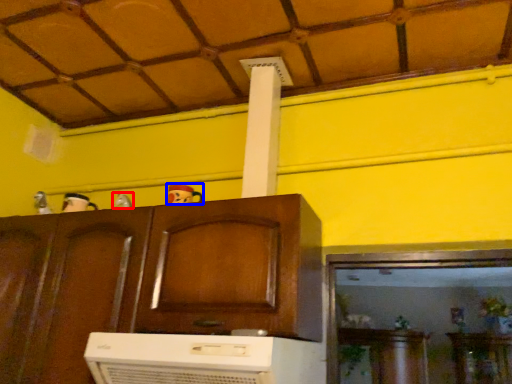
Question: Among these objects, which one is farthest to the camera, toy (highlighted by a red box) or toy (highlighted by a blue box)?

Choices:
 (A) toy
 (B) toy

Answer: (A)